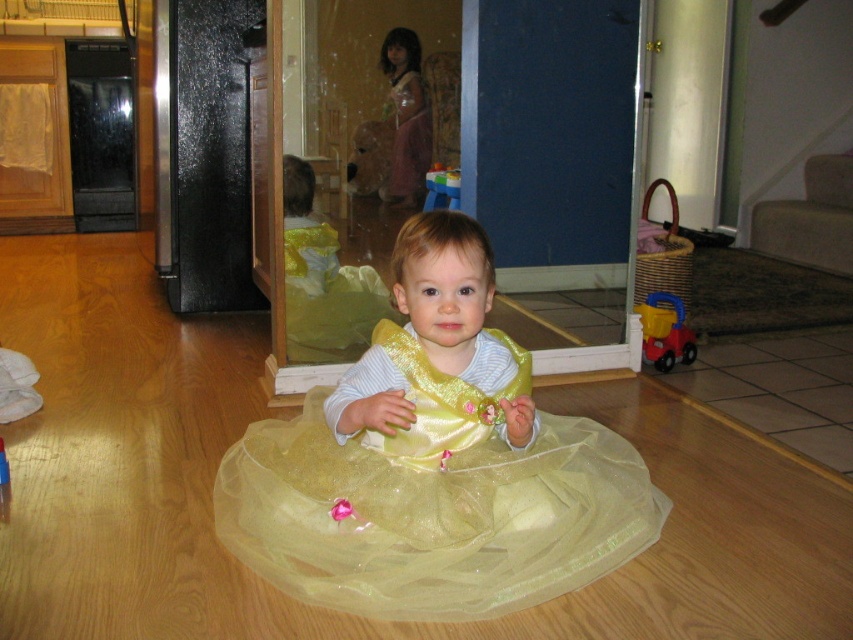
Question: Is matte plastic toy truck at lower right to the left of rubber red toy at center from the viewer's perspective?

Choices:
 (A) no
 (B) yes

Answer: (A)

Question: Which point is farther to the camera?

Choices:
 (A) shiny yellow tulle dress at center
 (B) rubber red toy at center
 (C) matte plastic toy truck at lower right
 (D) blue plastic toy at center

Answer: (D)

Question: Does matte plastic toy truck at lower right appear on the left side of blue plastic toy at center?

Choices:
 (A) yes
 (B) no

Answer: (B)

Question: Which of the following is the closest to the observer?

Choices:
 (A) rubber red toy at center
 (B) shiny yellow tulle dress at center
 (C) blue plastic toy at center

Answer: (B)

Question: Which point is closer to the camera?

Choices:
 (A) (4, 460)
 (B) (422, 205)
 (C) (583, 554)

Answer: (C)

Question: Is matte plastic toy truck at lower right behind blue plastic toy at center?

Choices:
 (A) yes
 (B) no

Answer: (B)